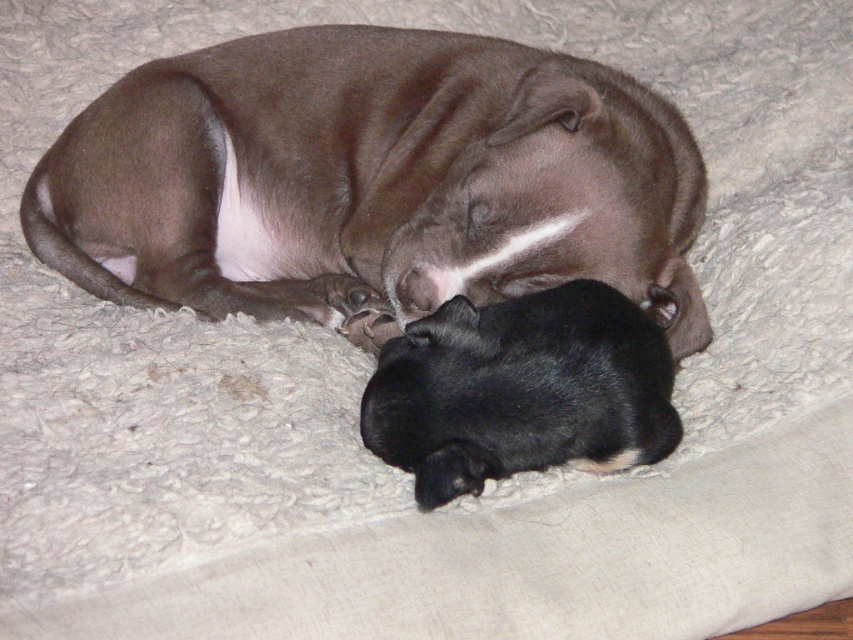
Question: Can you confirm if brown smooth dog at center is positioned to the right of black fur at lower center?

Choices:
 (A) yes
 (B) no

Answer: (B)

Question: Does brown smooth dog at center have a lesser width compared to black fur at lower center?

Choices:
 (A) no
 (B) yes

Answer: (A)

Question: Among these points, which one is farthest from the camera?

Choices:
 (A) (289, 93)
 (B) (451, 342)

Answer: (A)

Question: Which point is closer to the camera?

Choices:
 (A) (358, 29)
 (B) (527, 337)

Answer: (B)

Question: Is brown smooth dog at center to the right of black fur at lower center from the viewer's perspective?

Choices:
 (A) yes
 (B) no

Answer: (B)

Question: Which object appears closest to the camera in this image?

Choices:
 (A) brown smooth dog at center
 (B) black fur at lower center

Answer: (B)